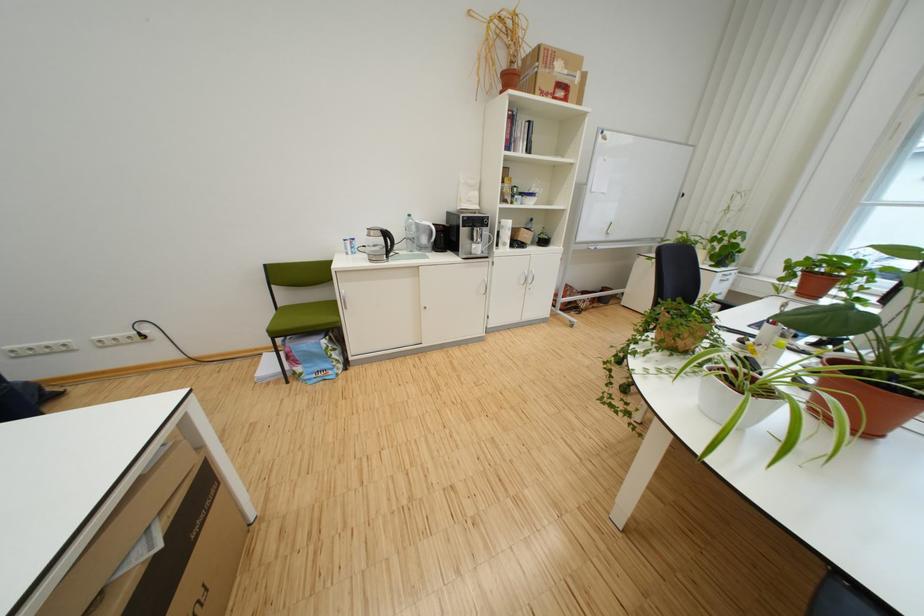
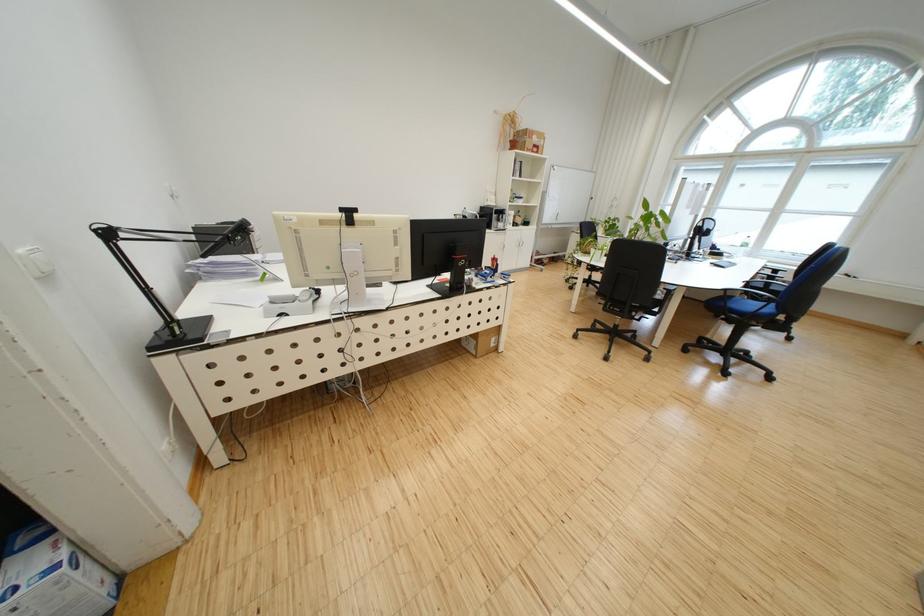
The point at (669, 357) is marked in the first image. Where is the corresponding point in the second image?

(592, 256)